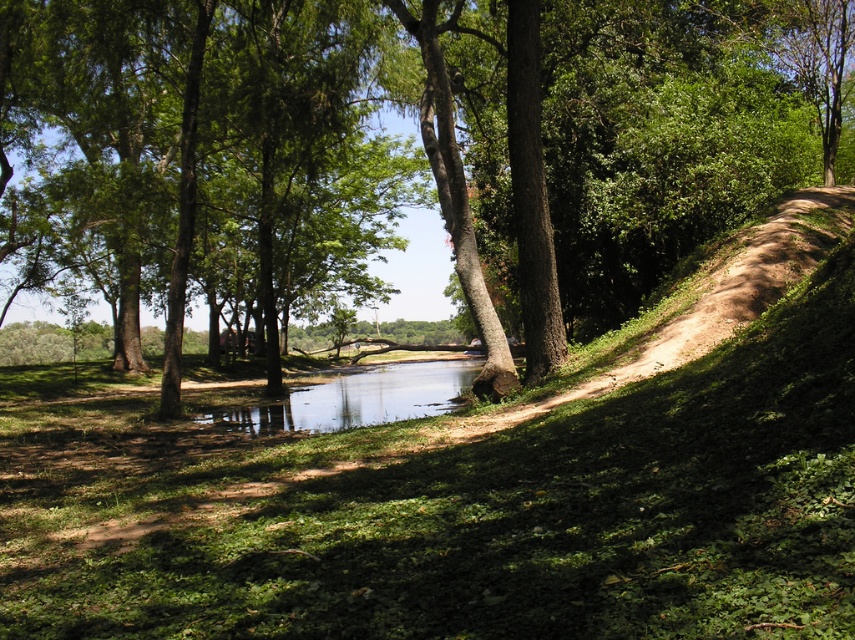
Question: Is green grassy hillside at lower right positioned at the back of green leafy tree at center?

Choices:
 (A) no
 (B) yes

Answer: (A)

Question: Which object is closer to the camera taking this photo?

Choices:
 (A) green grassy hillside at lower right
 (B) clear water at center
 (C) green leafy tree at center

Answer: (A)

Question: Can you confirm if green leafy tree at center is smaller than clear water at center?

Choices:
 (A) yes
 (B) no

Answer: (B)

Question: Which object is positioned farthest from the green leafy tree at center?

Choices:
 (A) clear water at center
 (B) green grassy hillside at lower right

Answer: (B)

Question: Which object appears closest to the camera in this image?

Choices:
 (A) green grassy hillside at lower right
 (B) clear water at center

Answer: (A)

Question: In this image, where is green leafy tree at center located relative to clear water at center?

Choices:
 (A) above
 (B) below

Answer: (A)